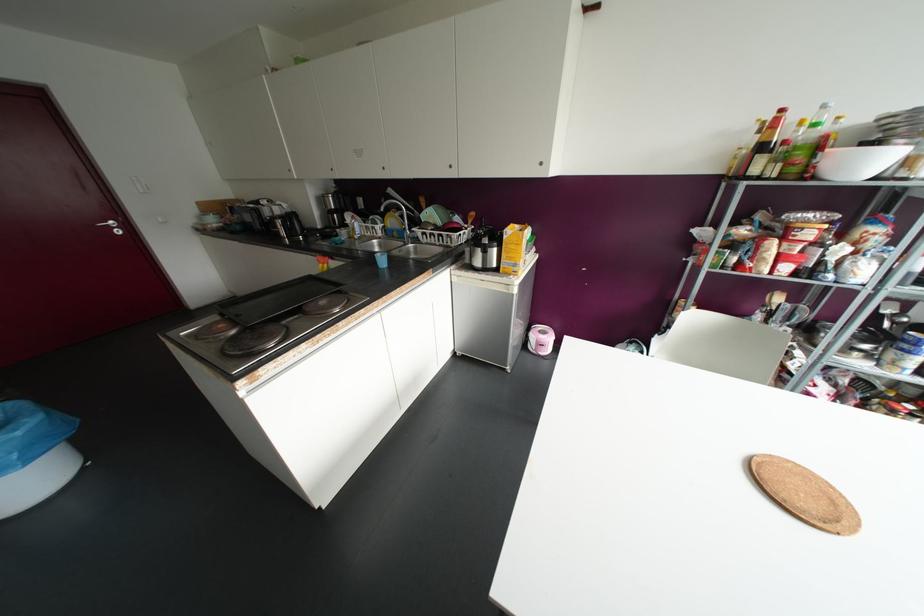
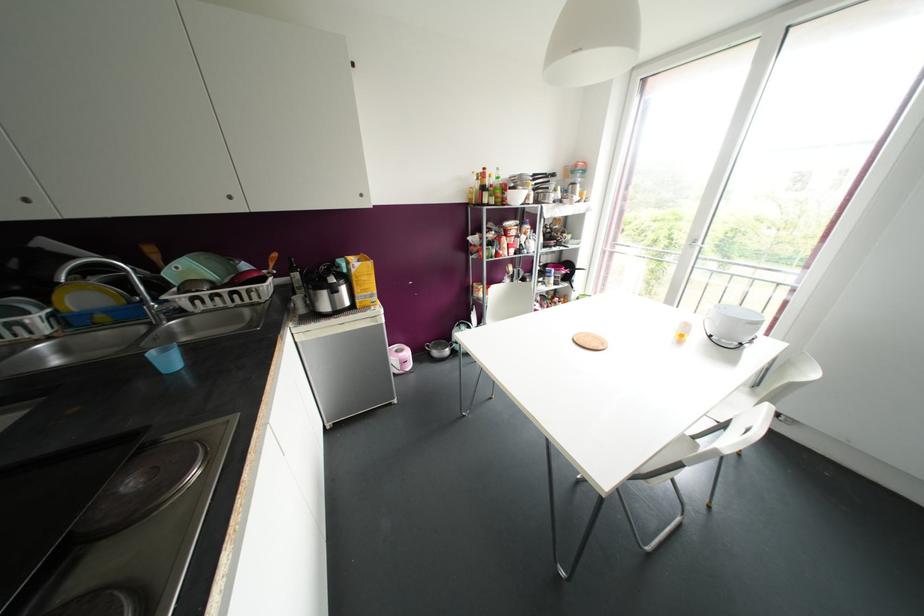
The point at (513,246) is marked in the first image. Where is the corresponding point in the second image?

(363, 277)